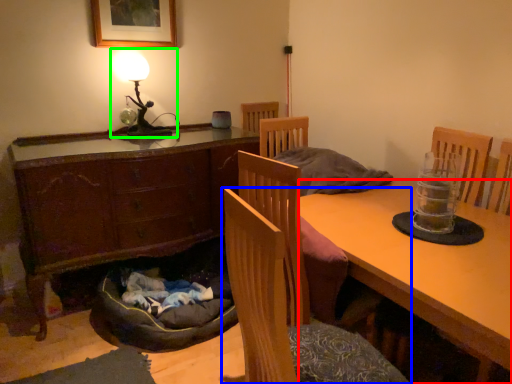
Question: Which object is positioned closest to desk (highlighted by a red box)? Select from chair (highlighted by a blue box) and table lamp (highlighted by a green box).

Choices:
 (A) chair
 (B) table lamp

Answer: (A)